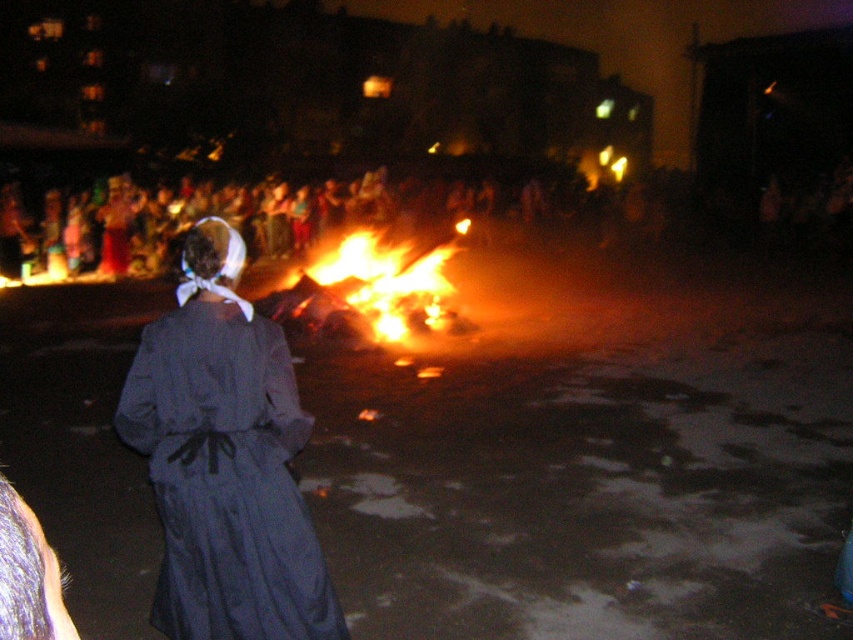
Between dark gray fabric dress at center and flaming wood at center, which one has more height?

dark gray fabric dress at center

Does point (184, 275) come closer to viewer compared to point (334, 301)?

That is True.

Where is `dark gray fabric dress at center`? Image resolution: width=853 pixels, height=640 pixels. dark gray fabric dress at center is located at coordinates (225, 460).